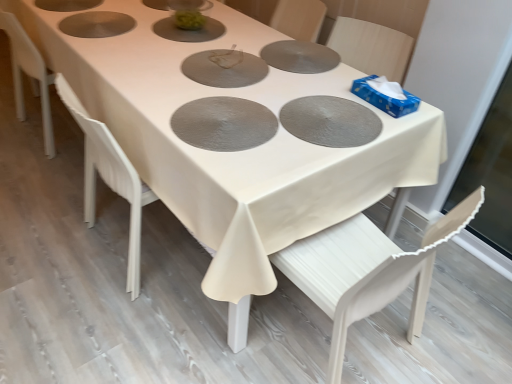
Question: Considering the positions of matte gray pizza pan at center, which ranks as the 1th pizza pan in top-to-bottom order, and textured silver pizza pan at center, which is counted as the third pizza pan, starting from the top, in the image, is matte gray pizza pan at center, which ranks as the 1th pizza pan in top-to-bottom order, taller or shorter than textured silver pizza pan at center, which is counted as the third pizza pan, starting from the top,?

Choices:
 (A) short
 (B) tall

Answer: (B)

Question: Choose the correct answer: Is matte gray pizza pan at center, which ranks as the third pizza pan in bottom-to-top order, inside textured silver pizza pan at center, which is counted as the third pizza pan, starting from the top, or outside it?

Choices:
 (A) inside
 (B) outside

Answer: (B)

Question: Based on their relative distances, which object is nearer to the matte gray pizza pan at center, which is the 2th pizza pan from top to bottom?

Choices:
 (A) white wood chair at lower right
 (B) matte gray pizza pan at center, which ranks as the third pizza pan in bottom-to-top order
 (C) textured silver pizza pan at center, arranged as the first pizza pan when ordered from the bottom

Answer: (C)

Question: Which object is positioned closest to the matte gray pizza pan at center, which ranks as the 1th pizza pan in top-to-bottom order?

Choices:
 (A) white wood chair at lower right
 (B) matte gray pizza pan at center, which is the 2th pizza pan from top to bottom
 (C) textured silver pizza pan at center, which is counted as the third pizza pan, starting from the top

Answer: (C)